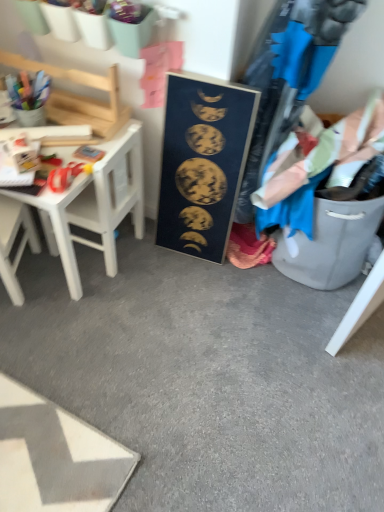
The width and height of the screenshot is (384, 512). In order to click on vacant space to the left of gold metallic moon phases at center in this screenshot , I will do (143, 258).